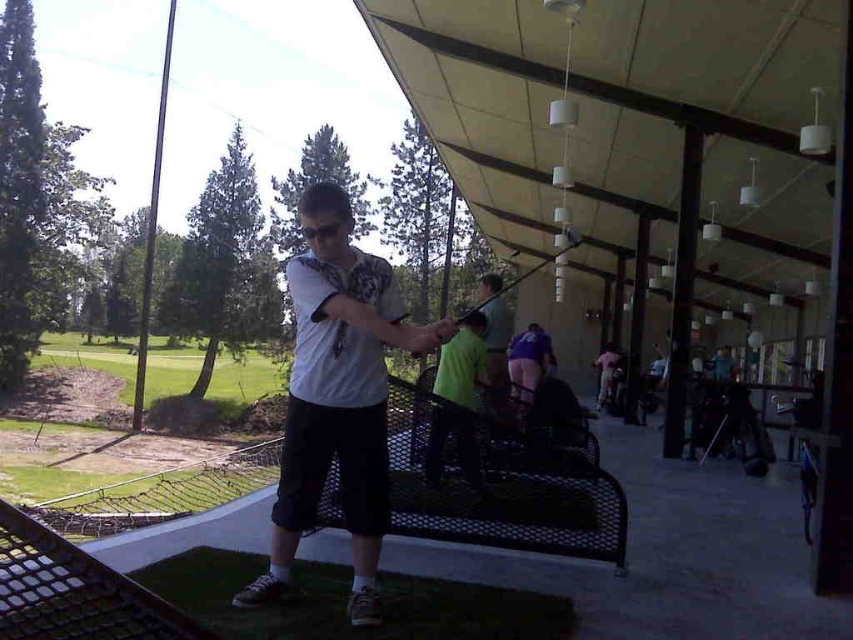
Question: Which object appears closest to the camera in this image?

Choices:
 (A) purple fabric shorts at center
 (B) neon green shirt at center
 (C) white matte shirt at center

Answer: (C)

Question: From the image, what is the correct spatial relationship of neon green shirt at center in relation to purple fabric shorts at center?

Choices:
 (A) below
 (B) above

Answer: (B)

Question: Which object is closer to the camera taking this photo?

Choices:
 (A) white matte shirt at center
 (B) purple fabric shorts at center
 (C) neon green shirt at center

Answer: (A)

Question: Considering the real-world distances, which object is farthest from the white matte shirt at center?

Choices:
 (A) purple fabric shorts at center
 (B) neon green shirt at center

Answer: (A)

Question: Can you confirm if white matte shirt at center is bigger than purple fabric shorts at center?

Choices:
 (A) yes
 (B) no

Answer: (A)

Question: Can you confirm if white matte shirt at center is positioned below neon green shirt at center?

Choices:
 (A) yes
 (B) no

Answer: (A)